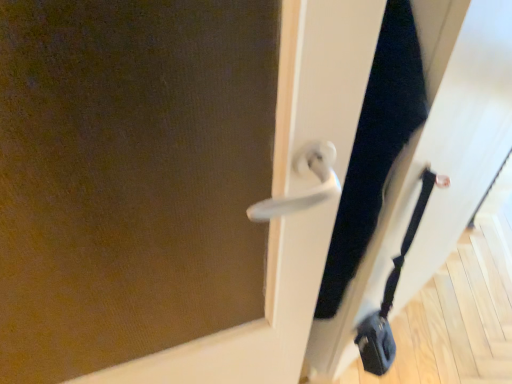
Describe the element at coordinates (434, 164) in the screenshot. This screenshot has height=384, width=512. I see `white glossy screen door at center` at that location.

Locate an element on the screen. This screenshot has width=512, height=384. white glossy screen door at center is located at coordinates (434, 164).

Locate an element on the screen. This screenshot has height=384, width=512. white glossy screen door at center is located at coordinates (434, 164).